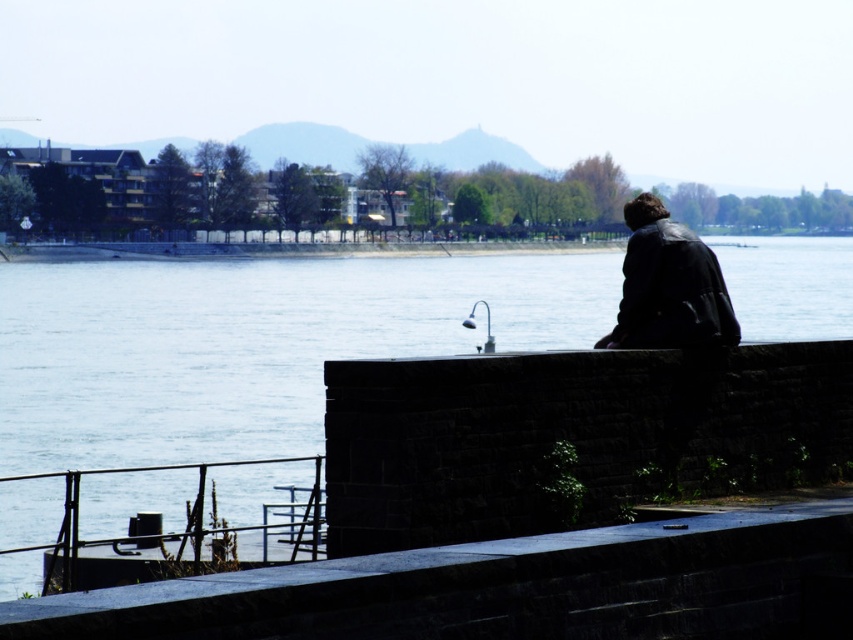
Question: Does smooth stone ledge at lower center have a larger size compared to leather jacket at right?

Choices:
 (A) no
 (B) yes

Answer: (B)

Question: Which point is farther to the camera?

Choices:
 (A) blue water at center
 (B) leather jacket at right

Answer: (B)

Question: Which object appears farthest from the camera in this image?

Choices:
 (A) leather jacket at right
 (B) blue water at center
 (C) smooth stone ledge at lower center

Answer: (A)

Question: Among these objects, which one is nearest to the camera?

Choices:
 (A) leather jacket at right
 (B) smooth stone ledge at lower center

Answer: (B)

Question: Is blue water at center wider than smooth stone ledge at lower center?

Choices:
 (A) yes
 (B) no

Answer: (A)

Question: Can you confirm if blue water at center is thinner than smooth stone ledge at lower center?

Choices:
 (A) yes
 (B) no

Answer: (B)